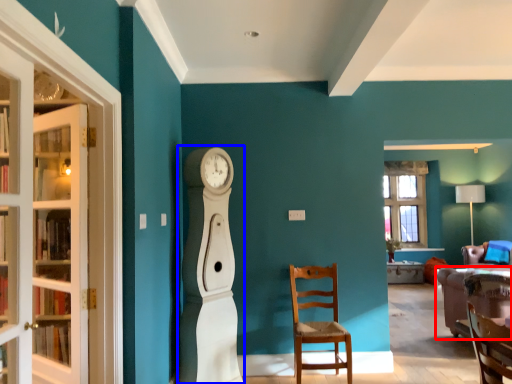
Question: Which object is further to the camera taking this photo, studio couch (highlighted by a red box) or open (highlighted by a blue box)?

Choices:
 (A) studio couch
 (B) open

Answer: (A)